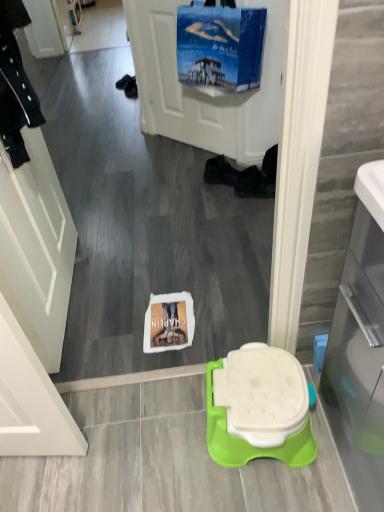
The height and width of the screenshot is (512, 384). Identify the location of vacant space to the right of white matte screen door at left, arranged as the first screen door when viewed from the front. (148, 279).